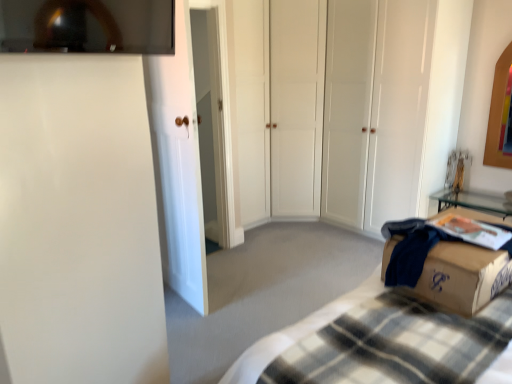
Question: Is white glossy door at left, which is the 2th glass door from right to left, positioned with its back to brown cardboard box at lower right?

Choices:
 (A) no
 (B) yes

Answer: (A)

Question: Is white glossy door at left, which is the 2th glass door from right to left, shorter than brown cardboard box at lower right?

Choices:
 (A) yes
 (B) no

Answer: (B)

Question: Is white glossy door at left, the 1th glass door viewed from the front, positioned far away from brown cardboard box at lower right?

Choices:
 (A) yes
 (B) no

Answer: (A)

Question: Does white glossy door at left, the second glass door positioned from the back, turn towards brown cardboard box at lower right?

Choices:
 (A) yes
 (B) no

Answer: (B)

Question: Considering the relative sizes of white glossy door at left, which ranks as the 1th glass door in left-to-right order, and brown cardboard box at lower right in the image provided, is white glossy door at left, which ranks as the 1th glass door in left-to-right order, wider than brown cardboard box at lower right?

Choices:
 (A) no
 (B) yes

Answer: (A)

Question: Considering the relative sizes of white glossy door at left, the second glass door positioned from the back, and brown cardboard box at lower right in the image provided, is white glossy door at left, the second glass door positioned from the back, thinner than brown cardboard box at lower right?

Choices:
 (A) yes
 (B) no

Answer: (A)

Question: Is white matte closet doors at center, which appears as the first glass door when viewed from the right, wider than plaid fabric bed at lower right?

Choices:
 (A) no
 (B) yes

Answer: (B)

Question: From a real-world perspective, is white matte closet doors at center, which is the 2th glass door from left to right, physically above plaid fabric bed at lower right?

Choices:
 (A) no
 (B) yes

Answer: (B)

Question: Is white matte closet doors at center, which is the 2th glass door from left to right, facing away from plaid fabric bed at lower right?

Choices:
 (A) no
 (B) yes

Answer: (A)

Question: Does white matte closet doors at center, the 1th glass door positioned from the back, lie in front of plaid fabric bed at lower right?

Choices:
 (A) yes
 (B) no

Answer: (B)

Question: Does white matte closet doors at center, which is the 2th glass door from left to right, have a lesser height compared to plaid fabric bed at lower right?

Choices:
 (A) no
 (B) yes

Answer: (A)

Question: Can you confirm if white matte closet doors at center, the 1th glass door positioned from the back, is positioned to the right of plaid fabric bed at lower right?

Choices:
 (A) yes
 (B) no

Answer: (A)

Question: Is plaid fabric bed at lower right taller than brown cardboard box at lower right?

Choices:
 (A) no
 (B) yes

Answer: (B)